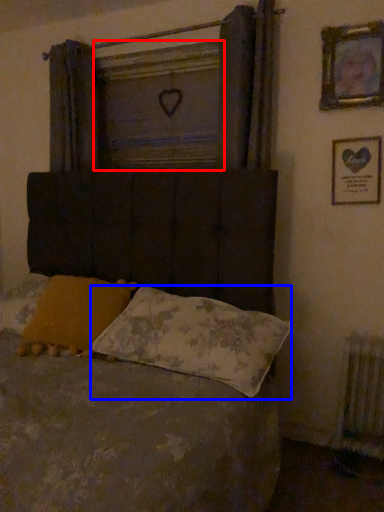
Question: Which of the following is the closest to the observer, window screen (highlighted by a red box) or pillow (highlighted by a blue box)?

Choices:
 (A) window screen
 (B) pillow

Answer: (B)